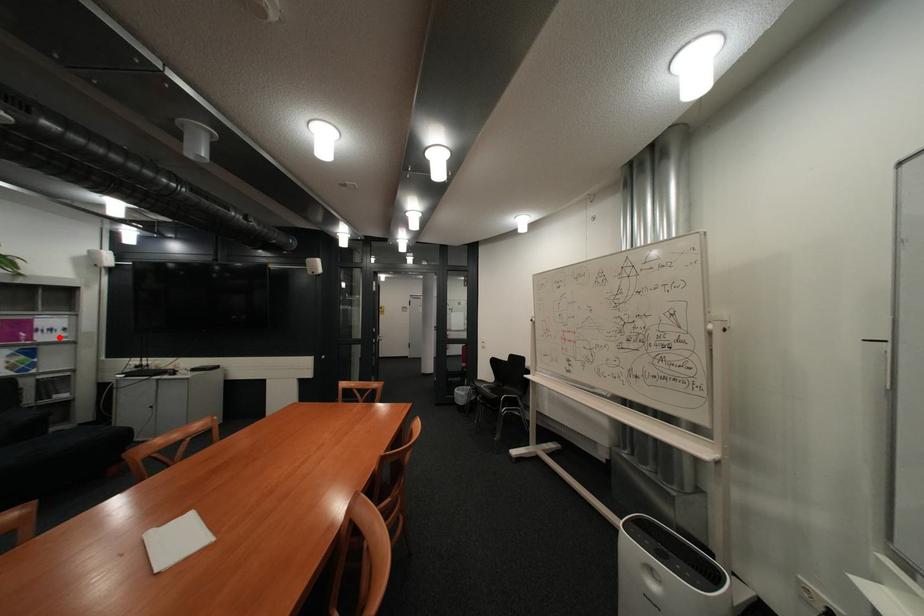
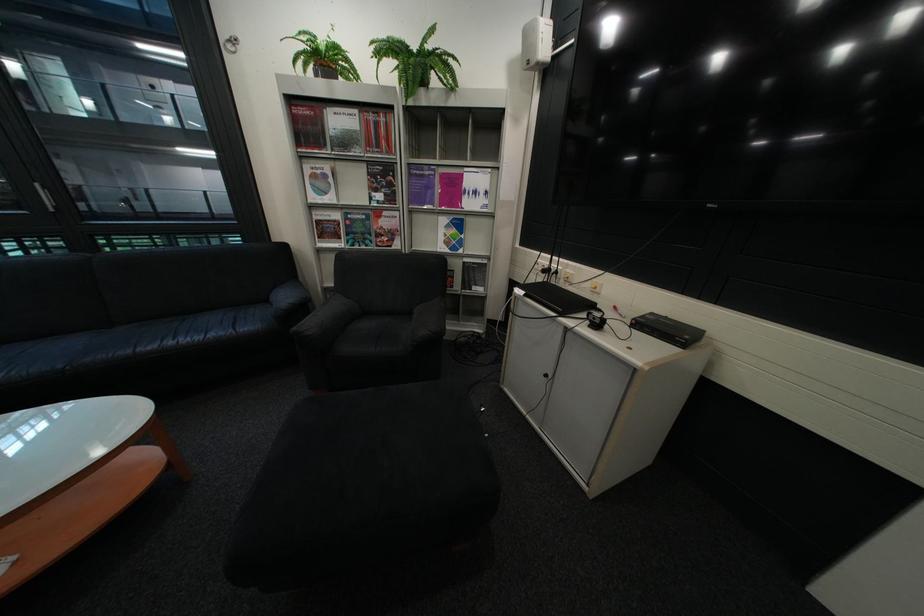
Locate, in the second image, the point that corresponds to the highlighted location in the first image.

(484, 204)